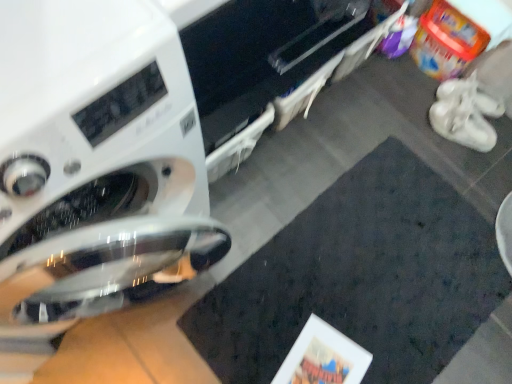
Question: Considering the positions of white glossy washing machine at left and white suede sneakers at right in the image, is white glossy washing machine at left taller or shorter than white suede sneakers at right?

Choices:
 (A) short
 (B) tall

Answer: (B)

Question: From a real-world perspective, is white glossy washing machine at left positioned above or below white suede sneakers at right?

Choices:
 (A) above
 (B) below

Answer: (A)

Question: Which is farther from the white suede sneakers at right?

Choices:
 (A) white glossy washing machine at left
 (B) white matte shoe at right
 (C) dark matte mat at center

Answer: (A)

Question: Which object is the closest to the white matte shoe at right?

Choices:
 (A) white suede sneakers at right
 (B) dark matte mat at center
 (C) white glossy washing machine at left

Answer: (A)